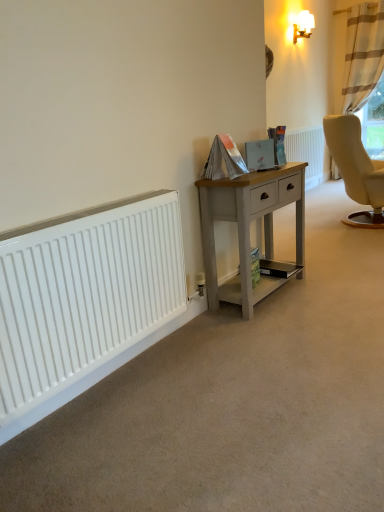
Locate an element on the screen. The image size is (384, 512). vacant space in front of light gray wood desk at center is located at coordinates (291, 330).